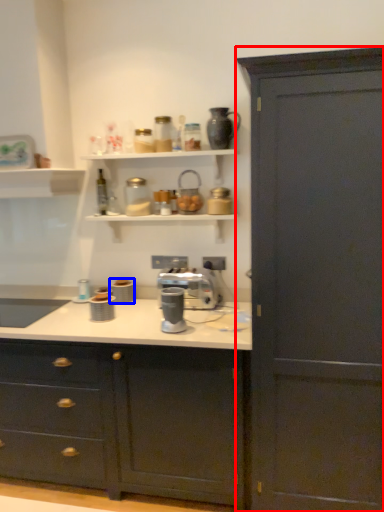
Question: Which object appears farthest to the camera in this image, cabinetry (highlighted by a red box) or appliance (highlighted by a blue box)?

Choices:
 (A) cabinetry
 (B) appliance

Answer: (B)